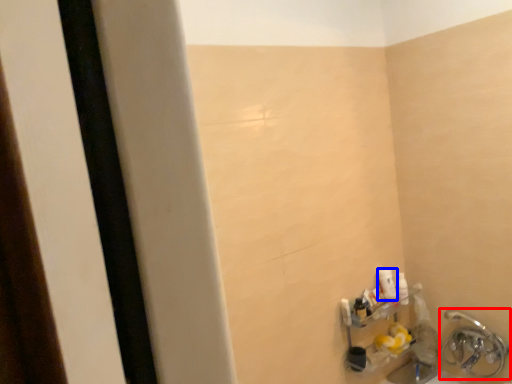
Question: Which point is closer to the camera, plumbing fixture (highlighted by a red box) or toiletry (highlighted by a blue box)?

Choices:
 (A) plumbing fixture
 (B) toiletry

Answer: (A)